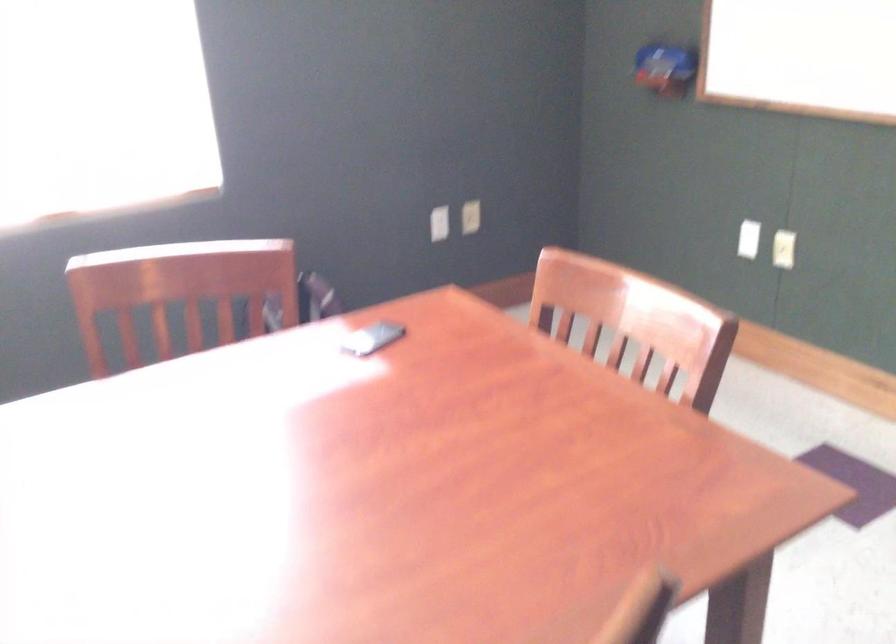
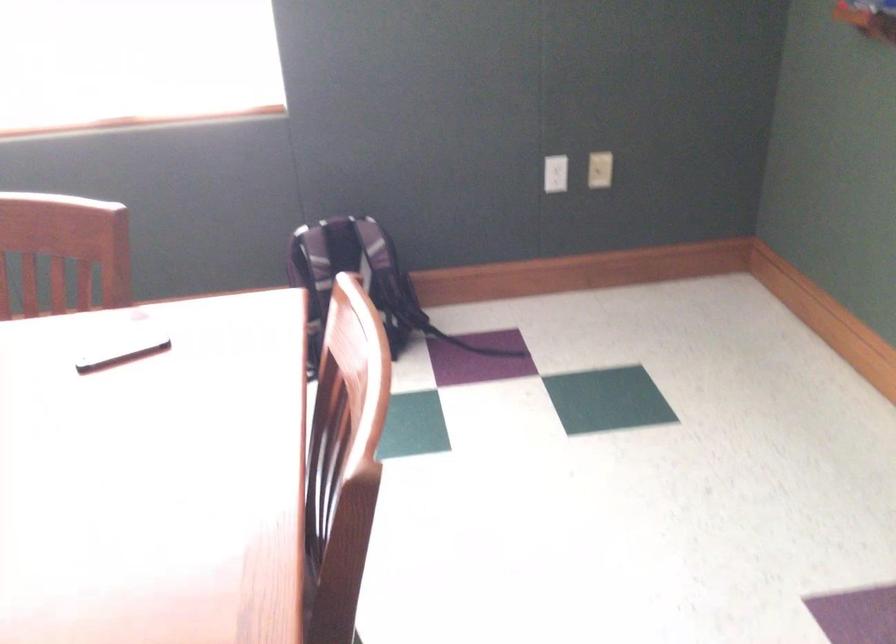
Question: Based on the continuous images, in which direction is the camera rotating? Reply with the corresponding letter.

Choices:
 (A) Left
 (B) Right
 (C) Up
 (D) Down

Answer: (A)